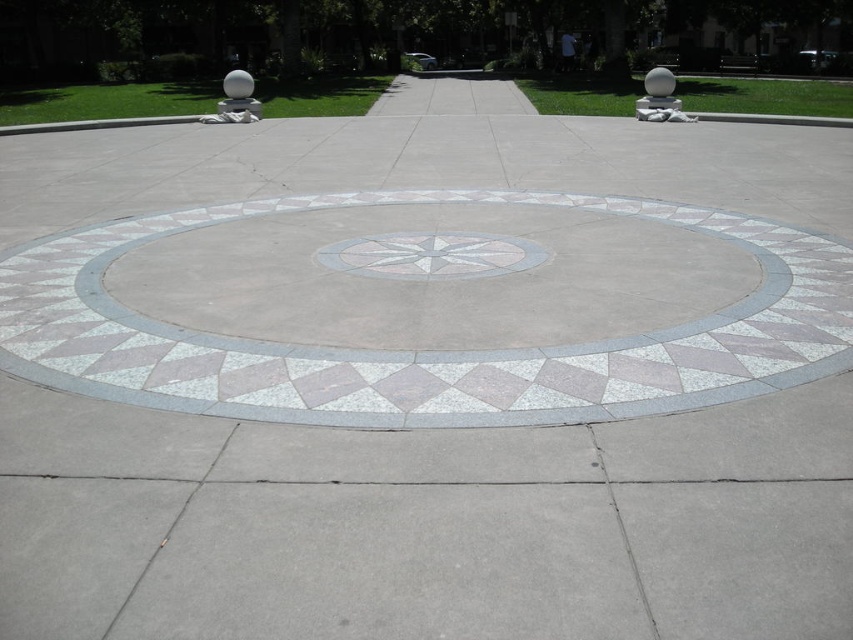
Question: Among these objects, which one is farthest from the camera?

Choices:
 (A) white marble compass at center
 (B) white mosaic circle at center

Answer: (B)

Question: Which of the following is the farthest from the observer?

Choices:
 (A) white mosaic circle at center
 (B) white marble compass at center

Answer: (A)

Question: Which object is farther from the camera taking this photo?

Choices:
 (A) white mosaic circle at center
 (B) white marble compass at center

Answer: (A)

Question: Does white mosaic circle at center appear on the right side of white marble compass at center?

Choices:
 (A) no
 (B) yes

Answer: (B)

Question: Is white mosaic circle at center above white marble compass at center?

Choices:
 (A) no
 (B) yes

Answer: (B)

Question: Is white mosaic circle at center thinner than white marble compass at center?

Choices:
 (A) yes
 (B) no

Answer: (B)